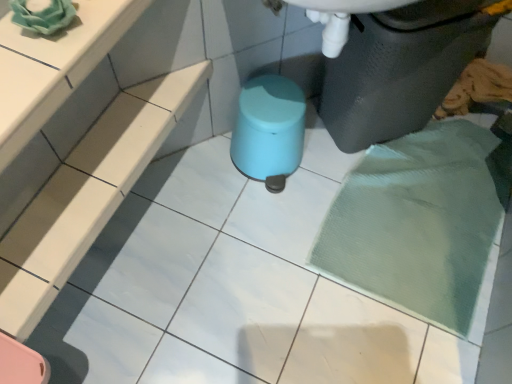
Locate an element on the screen. matte plastic waste container at lower right is located at coordinates pyautogui.click(x=400, y=68).

This screenshot has width=512, height=384. What do you see at coordinates (400, 68) in the screenshot?
I see `matte plastic waste container at lower right` at bounding box center [400, 68].

Where is `mint glossy stool at center`? mint glossy stool at center is located at coordinates (269, 130).

What do you see at coordinates (269, 130) in the screenshot? This screenshot has height=384, width=512. I see `mint glossy stool at center` at bounding box center [269, 130].

The width and height of the screenshot is (512, 384). I want to click on matte plastic waste container at lower right, so 400,68.

In the image, is mint glossy stool at center on the left side or the right side of matte plastic waste container at lower right?

Based on their positions, mint glossy stool at center is located to the left of matte plastic waste container at lower right.

Considering their positions, is mint glossy stool at center located in front of or behind matte plastic waste container at lower right?

mint glossy stool at center is behind matte plastic waste container at lower right.

Does point (298, 105) come farther from viewer compared to point (391, 113)?

No, it is in front of (391, 113).

From the image's perspective, is mint glossy stool at center located above or below matte plastic waste container at lower right?

Clearly, from the image's perspective, mint glossy stool at center is below matte plastic waste container at lower right.

From a real-world perspective, is mint glossy stool at center over matte plastic waste container at lower right?

No, from a real-world perspective, mint glossy stool at center is not on top of matte plastic waste container at lower right.

Between mint glossy stool at center and matte plastic waste container at lower right, which one has smaller width?

matte plastic waste container at lower right.

Which of these two, mint glossy stool at center or matte plastic waste container at lower right, stands taller?

With more height is matte plastic waste container at lower right.

Considering the sizes of objects mint glossy stool at center and matte plastic waste container at lower right in the image provided, who is smaller, mint glossy stool at center or matte plastic waste container at lower right?

mint glossy stool at center.

Is matte plastic waste container at lower right a part of mint glossy stool at center?

No, matte plastic waste container at lower right is not inside mint glossy stool at center.

Is mint glossy stool at center touching matte plastic waste container at lower right?

No, mint glossy stool at center is not next to matte plastic waste container at lower right.

Is mint glossy stool at center turned away from matte plastic waste container at lower right?

No, mint glossy stool at center's orientation is not away from matte plastic waste container at lower right.

How far apart are mint glossy stool at center and matte plastic waste container at lower right?

The distance of mint glossy stool at center from matte plastic waste container at lower right is 11.31 inches.

Where is `waste container on the right of mint glossy stool at center`? waste container on the right of mint glossy stool at center is located at coordinates (400, 68).

In the scene shown: Considering the positions of objects matte plastic waste container at lower right and mint glossy stool at center in the image provided, who is more to the left, matte plastic waste container at lower right or mint glossy stool at center?

From the viewer's perspective, mint glossy stool at center appears more on the left side.

Between matte plastic waste container at lower right and mint glossy stool at center, which one is positioned behind?

mint glossy stool at center is further from the camera.

Considering the points (395, 90) and (234, 125), which point is in front, point (395, 90) or point (234, 125)?

The point (395, 90) is in front.

In the scene shown: From the image's perspective, is matte plastic waste container at lower right located above mint glossy stool at center?

Yes, from the image's perspective, matte plastic waste container at lower right is on top of mint glossy stool at center.

From a real-world perspective, which is physically above, matte plastic waste container at lower right or mint glossy stool at center?

matte plastic waste container at lower right.

From the picture: In terms of width, does matte plastic waste container at lower right look wider or thinner when compared to mint glossy stool at center?

Considering their sizes, matte plastic waste container at lower right looks slimmer than mint glossy stool at center.

Who is taller, matte plastic waste container at lower right or mint glossy stool at center?

matte plastic waste container at lower right is taller.

In terms of size, does matte plastic waste container at lower right appear bigger or smaller than mint glossy stool at center?

Considering their sizes, matte plastic waste container at lower right takes up more space than mint glossy stool at center.

Is matte plastic waste container at lower right located outside mint glossy stool at center?

matte plastic waste container at lower right is positioned outside mint glossy stool at center.

Is there a large distance between matte plastic waste container at lower right and mint glossy stool at center?

No, matte plastic waste container at lower right is in close proximity to mint glossy stool at center.

Is mint glossy stool at center at the back of matte plastic waste container at lower right?

No, matte plastic waste container at lower right's orientation is not away from mint glossy stool at center.

What's the angular difference between matte plastic waste container at lower right and mint glossy stool at center's facing directions?

The angular difference between matte plastic waste container at lower right and mint glossy stool at center is 9.3 degrees.

The width and height of the screenshot is (512, 384). What are the coordinates of `waste container in front of the mint glossy stool at center` in the screenshot? It's located at (400, 68).

Image resolution: width=512 pixels, height=384 pixels. In order to click on waste container located on the right of mint glossy stool at center in this screenshot , I will do `click(400, 68)`.

You are a GUI agent. You are given a task and a screenshot of the screen. Output one action in this format:
    pyautogui.click(x=<x>, y=<y>)
    Task: Click on the stool that appears below the matte plastic waste container at lower right (from the image's perspective)
    The height and width of the screenshot is (384, 512).
    Given the screenshot: What is the action you would take?
    pyautogui.click(x=269, y=130)